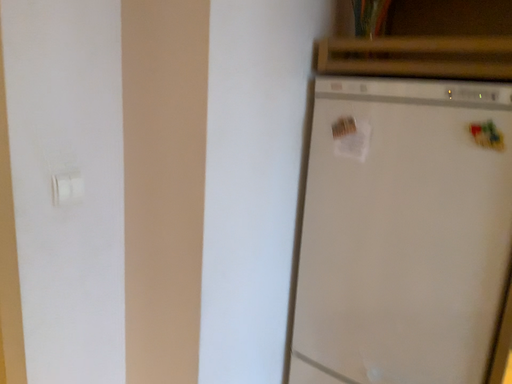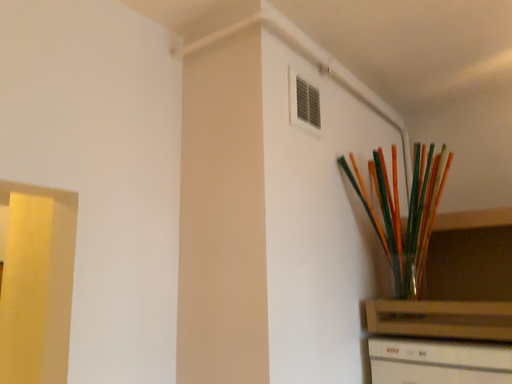
Question: Which way did the camera rotate in the video?

Choices:
 (A) rotated downward
 (B) rotated upward

Answer: (B)